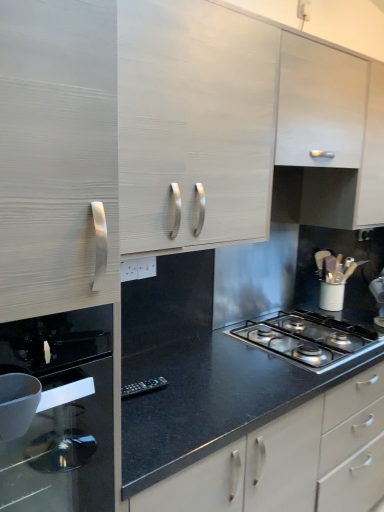
Question: Does matte white cabinet at upper left, which ranks as the first cabinetry in left-to-right order, lie in front of white matte utensil holder at right?

Choices:
 (A) yes
 (B) no

Answer: (A)

Question: Are matte white cabinet at upper left, which ranks as the first cabinetry in left-to-right order, and white matte utensil holder at right far apart?

Choices:
 (A) no
 (B) yes

Answer: (B)

Question: From the image's perspective, is matte white cabinet at upper left, which ranks as the first cabinetry in left-to-right order, located above white matte utensil holder at right?

Choices:
 (A) no
 (B) yes

Answer: (B)

Question: Does matte white cabinet at upper left, which ranks as the second cabinetry in right-to-left order, have a greater height compared to white matte utensil holder at right?

Choices:
 (A) no
 (B) yes

Answer: (B)

Question: Considering the relative sizes of matte white cabinet at upper left, which ranks as the first cabinetry in left-to-right order, and white matte utensil holder at right in the image provided, is matte white cabinet at upper left, which ranks as the first cabinetry in left-to-right order, bigger than white matte utensil holder at right?

Choices:
 (A) yes
 (B) no

Answer: (A)

Question: Can you confirm if matte white cabinet at upper left, which ranks as the first cabinetry in left-to-right order, is positioned to the right of white matte utensil holder at right?

Choices:
 (A) no
 (B) yes

Answer: (A)

Question: Is black glass oven at left next to white wood cabinet at upper center, the 1th cabinetry in the right-to-left sequence?

Choices:
 (A) no
 (B) yes

Answer: (A)

Question: From the image's perspective, is black glass oven at left on white wood cabinet at upper center, the second cabinetry from the left?

Choices:
 (A) yes
 (B) no

Answer: (B)

Question: Is black glass oven at left not close to white wood cabinet at upper center, the second cabinetry from the left?

Choices:
 (A) no
 (B) yes

Answer: (B)

Question: Is black glass oven at left outside of white wood cabinet at upper center, the 1th cabinetry in the right-to-left sequence?

Choices:
 (A) no
 (B) yes

Answer: (B)

Question: Is black glass oven at left facing towards white wood cabinet at upper center, the 1th cabinetry in the right-to-left sequence?

Choices:
 (A) yes
 (B) no

Answer: (B)

Question: Is black glass oven at left at the left side of white wood cabinet at upper center, the second cabinetry from the left?

Choices:
 (A) no
 (B) yes

Answer: (B)

Question: Is black glass oven at left closer to the viewer compared to polished stainless steel gas stove at center?

Choices:
 (A) no
 (B) yes

Answer: (B)